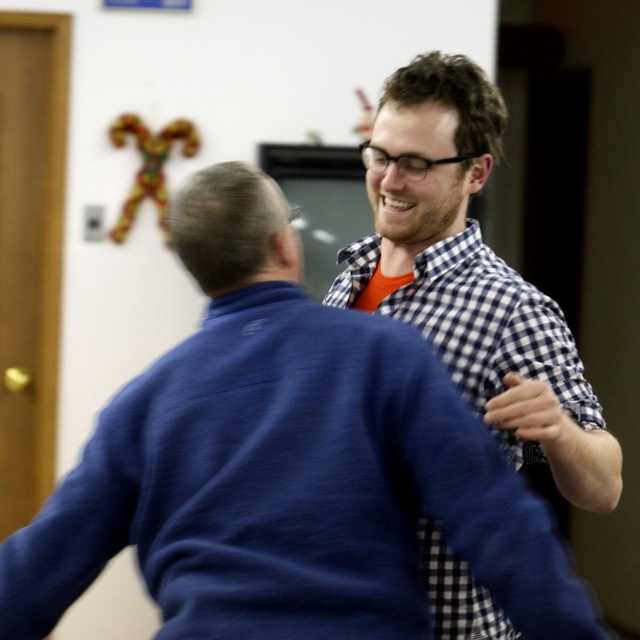
Question: Which point is farther to the camera?

Choices:
 (A) checkered fabric shirt at upper right
 (B) white checkered shirt at right

Answer: (B)

Question: Which object appears farthest from the camera in this image?

Choices:
 (A) white checkered shirt at right
 (B) checkered fabric shirt at upper right

Answer: (A)

Question: Which point is farther to the camera?

Choices:
 (A) (419, 310)
 (B) (348, 451)

Answer: (A)

Question: Where is checkered fabric shirt at upper right located in relation to white checkered shirt at right in the image?

Choices:
 (A) right
 (B) left

Answer: (B)

Question: Does checkered fabric shirt at upper right appear under white checkered shirt at right?

Choices:
 (A) no
 (B) yes

Answer: (B)

Question: Is checkered fabric shirt at upper right closer to the viewer compared to white checkered shirt at right?

Choices:
 (A) yes
 (B) no

Answer: (A)